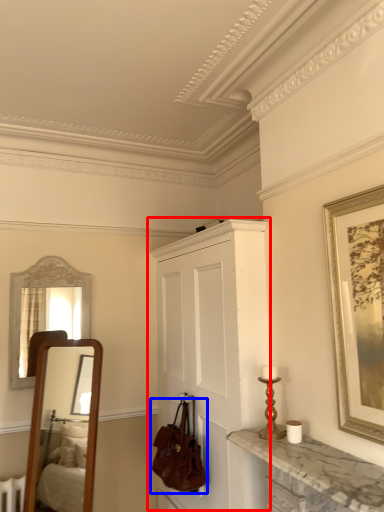
Question: Which of the following is the closest to the observer, cabinetry (highlighted by a red box) or handbag (highlighted by a blue box)?

Choices:
 (A) cabinetry
 (B) handbag

Answer: (A)